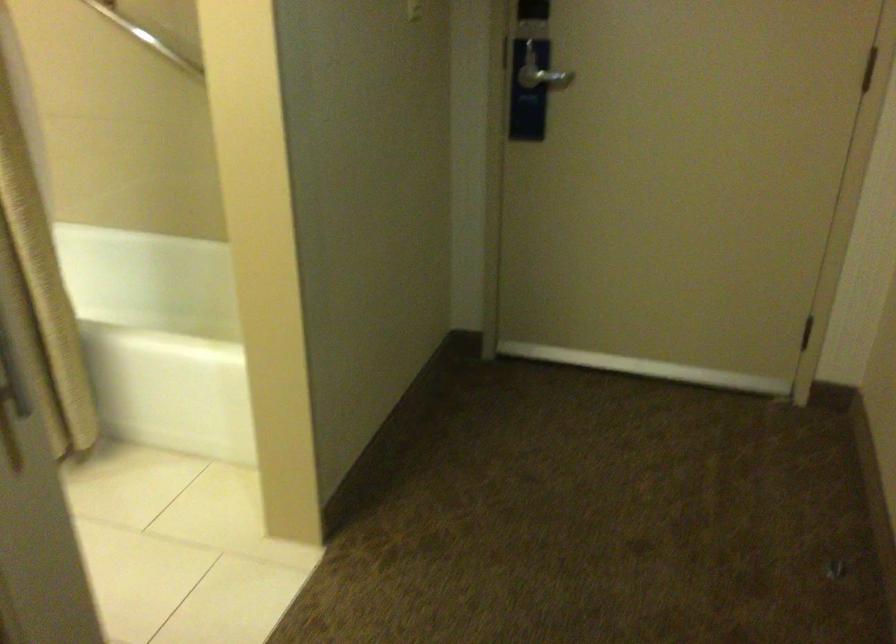
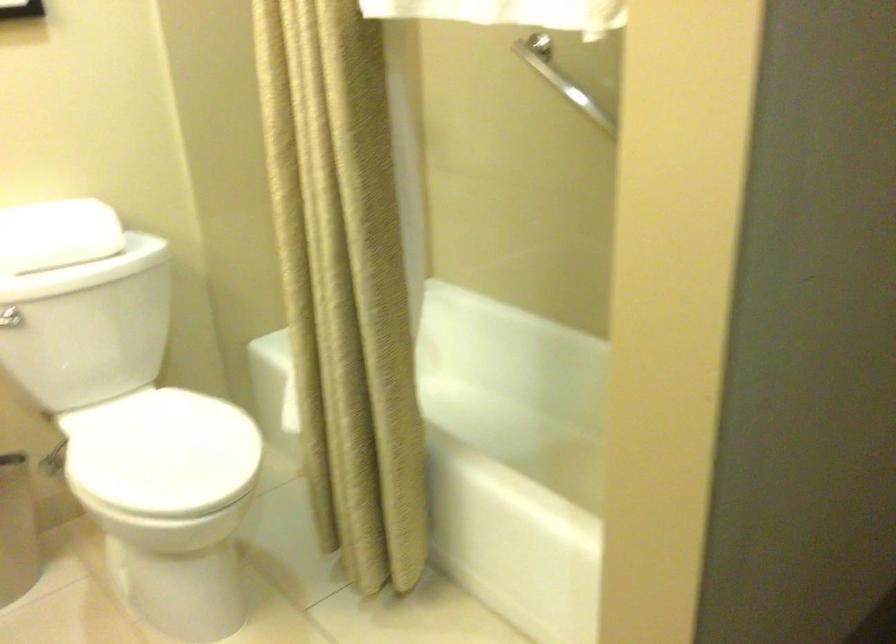
Question: What movement of the cameraman would produce the second image?

Choices:
 (A) Left
 (B) Right
 (C) Forward
 (D) Backward

Answer: (C)